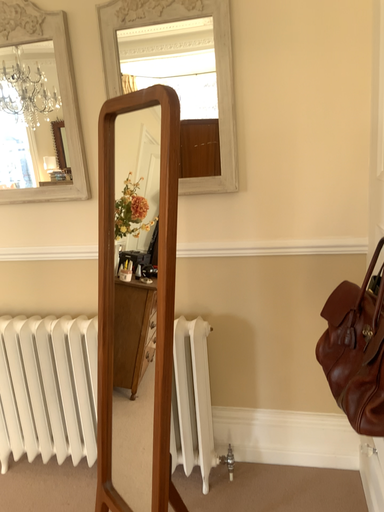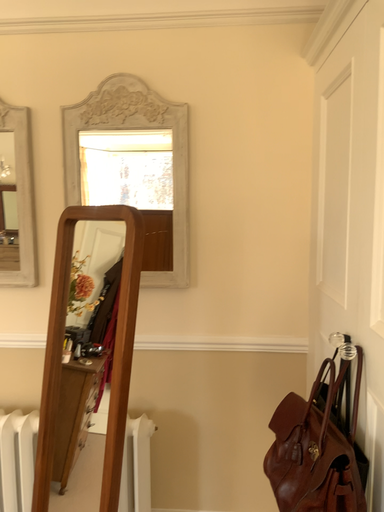
Question: How did the camera likely rotate when shooting the video?

Choices:
 (A) rotated left
 (B) rotated right

Answer: (B)